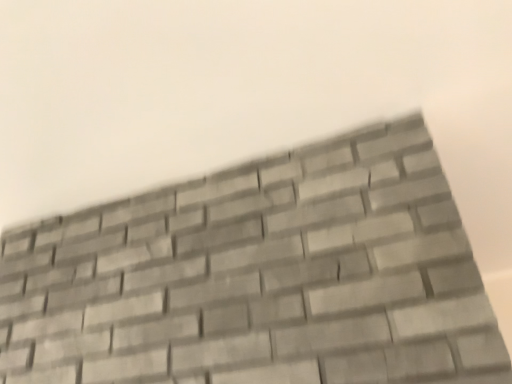
Locate an element on the screen. gray concrete brickwork at center is located at coordinates (259, 277).

Image resolution: width=512 pixels, height=384 pixels. Describe the element at coordinates (259, 277) in the screenshot. I see `gray concrete brickwork at center` at that location.

Identify the location of gray concrete brickwork at center. The height and width of the screenshot is (384, 512). (259, 277).